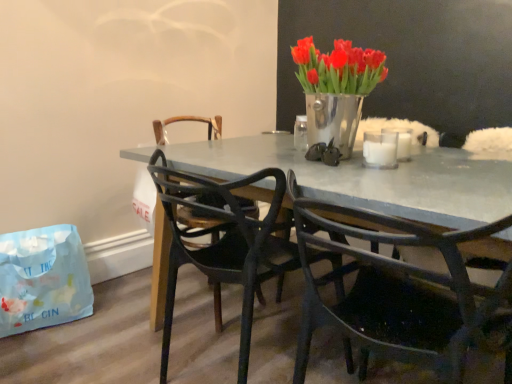
This screenshot has height=384, width=512. Find the location of `vacant point above light blue paper bag at lower left (from a real-world perspective)`. vacant point above light blue paper bag at lower left (from a real-world perspective) is located at coordinates (36, 232).